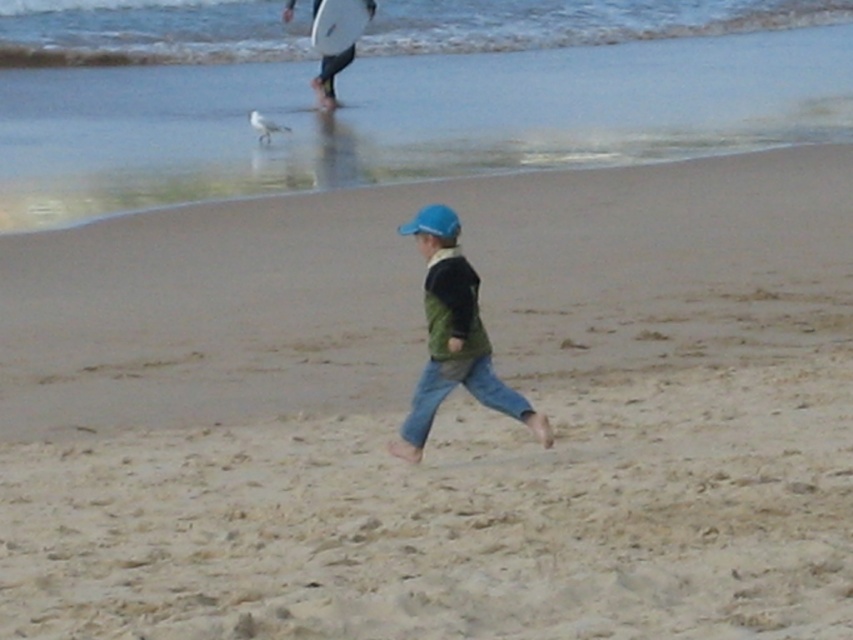
Question: Does white foam surfboard at upper center appear on the right side of white feathered gull at upper center?

Choices:
 (A) no
 (B) yes

Answer: (B)

Question: Which object is positioned closest to the white foam surfboard at upper center?

Choices:
 (A) blue matte baseball hat at center
 (B) green matte jacket at center
 (C) white smooth water at upper center
 (D) white glossy surfboard at upper center

Answer: (D)

Question: From the image, what is the correct spatial relationship of green matte jacket at center in relation to white glossy surfboard at upper center?

Choices:
 (A) below
 (B) above

Answer: (A)

Question: Does green matte jacket at center come behind white foam surfboard at upper center?

Choices:
 (A) yes
 (B) no

Answer: (B)

Question: Which point appears closest to the camera in this image?

Choices:
 (A) (90, 60)
 (B) (250, 116)

Answer: (B)

Question: Which object is closer to the camera taking this photo?

Choices:
 (A) white smooth water at upper center
 (B) white glossy surfboard at upper center

Answer: (A)